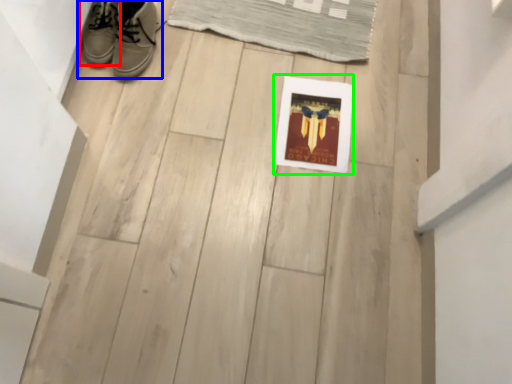
Question: Based on their relative distances, which object is nearer to footwear (highlighted by a red box)? Choose from footwear (highlighted by a blue box) and picture frame (highlighted by a green box).

Choices:
 (A) footwear
 (B) picture frame

Answer: (A)